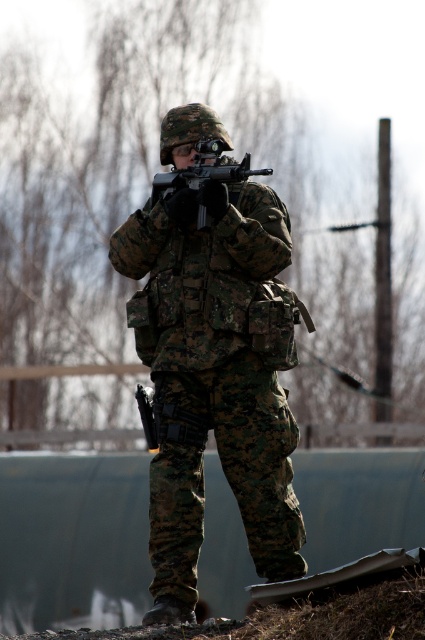
Question: Is camouflage uniform at center bigger than matte black rifle at center?

Choices:
 (A) yes
 (B) no

Answer: (A)

Question: Is camouflage uniform at center to the left of matte black rifle at center from the viewer's perspective?

Choices:
 (A) yes
 (B) no

Answer: (B)

Question: Is camouflage uniform at center smaller than matte black rifle at center?

Choices:
 (A) no
 (B) yes

Answer: (A)

Question: Which object is farther from the camera taking this photo?

Choices:
 (A) camouflage uniform at center
 (B) matte black rifle at center

Answer: (B)